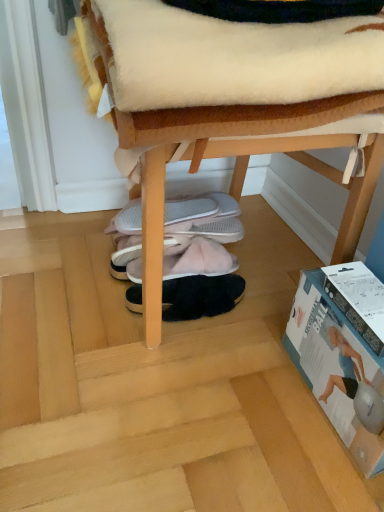
This screenshot has height=512, width=384. I want to click on vacant region above black fuzzy slippers at center, the first footwear ordered from the bottom (from a real-world perspective), so click(190, 286).